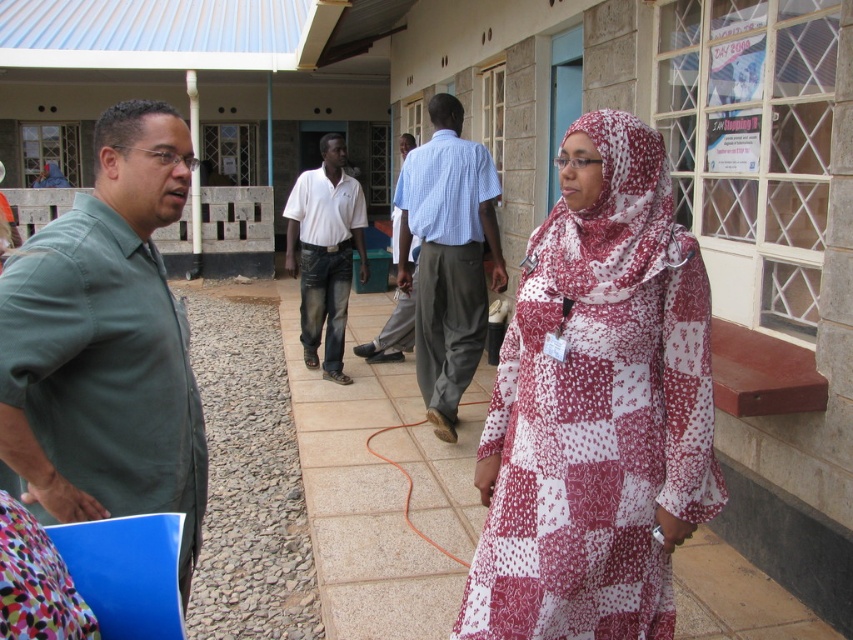
You are a delivery person standing at the entrance of the health facility. You need to deliver a package to the person wearing the green cotton shirt at left and then to the person wearing the light blue striped shirt at center. Is there enough space between them for you to navigate through while carrying the package?

The distance between the green cotton shirt at left and the light blue striped shirt at center is 3.70 meters, which should provide ample space for a delivery person to navigate through while carrying a package.

You are standing at the point with coordinates point (440, 115) and want to walk towards the point with coordinates point (328, 218). Given that the path between them is straight, will you be moving closer to or farther away from the camera as you walk?

Since point (440, 115) is closer to the camera than point (328, 218), walking towards the latter will take you farther away from the camera.

You are a visitor at this health facility and need to locate the healthcare professional. Based on the description, which of the two individuals at center is more likely to be the healthcare professional, the one wearing the white and red patterned dress at center or the white cotton shirt at center?

The woman wearing the white and red patterned dress at center is more likely to be the healthcare professional because she has a stethoscope around her neck, which is a common medical tool.